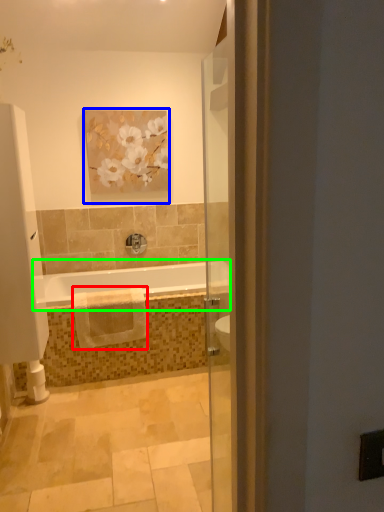
Question: Which object is the closest to the material (highlighted by a red box)? Choose among these: picture frame (highlighted by a blue box) or bathtub (highlighted by a green box).

Choices:
 (A) picture frame
 (B) bathtub

Answer: (B)